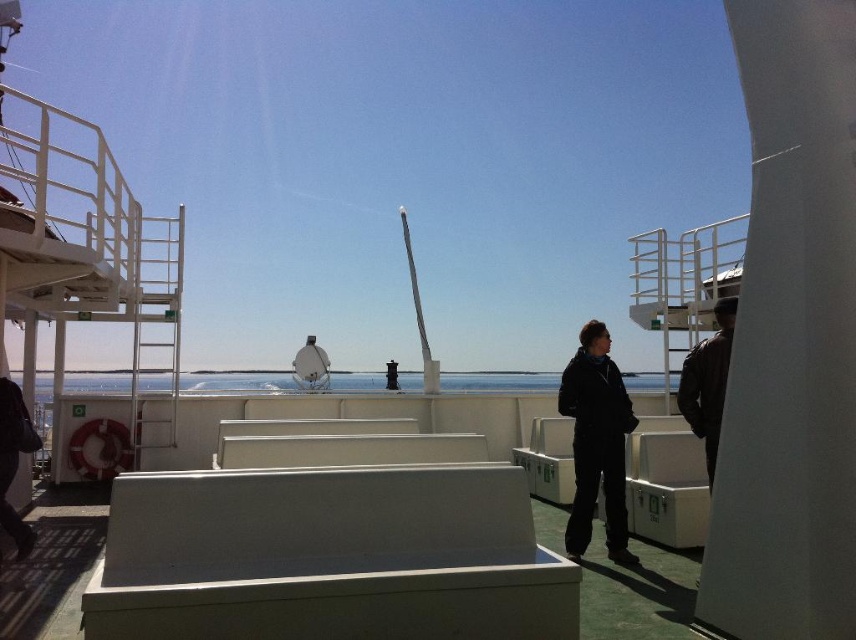
Which is below, black matte jacket at center or dark brown leather jacket at right?

black matte jacket at center is lower down.

Between black matte jacket at center and dark brown leather jacket at right, which one appears on the right side from the viewer's perspective?

Positioned to the right is dark brown leather jacket at right.

Find the location of a particular element. black matte jacket at center is located at coordinates (596, 442).